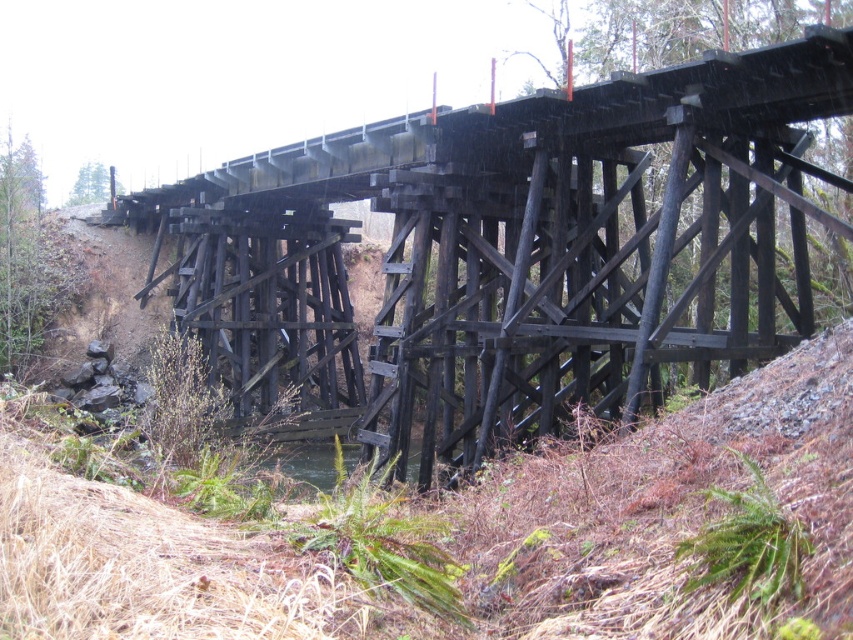
Question: Which point is farther from the camera taking this photo?

Choices:
 (A) (26, 196)
 (B) (399, 552)
 (C) (84, 179)

Answer: (C)

Question: Which of the following is the farthest from the observer?

Choices:
 (A) (94, 180)
 (B) (299, 541)

Answer: (A)

Question: Does green fuzzy fern at lower right appear on the right side of green leafy tree at upper left?

Choices:
 (A) yes
 (B) no

Answer: (A)

Question: Estimate the real-world distances between objects in this image. Which object is closer to the green fuzzy fern at lower right?

Choices:
 (A) green leafy tree at upper left
 (B) black wood bridge at center
 (C) green leafy plant at lower center

Answer: (C)

Question: Does black wood bridge at center appear on the right side of green leafy tree at upper left?

Choices:
 (A) yes
 (B) no

Answer: (A)

Question: Does green leafy plant at lower center appear over green fuzzy fern at lower right?

Choices:
 (A) yes
 (B) no

Answer: (B)